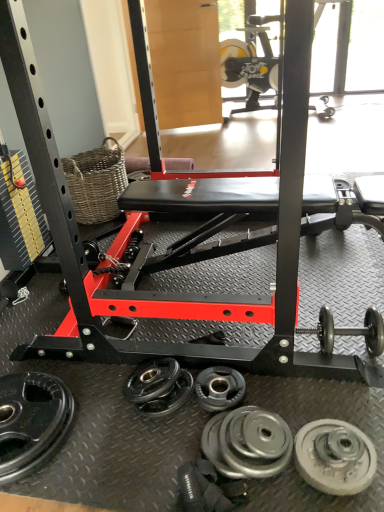
I want to click on free space in front of polished silver dumbbell at lower right, so click(338, 397).